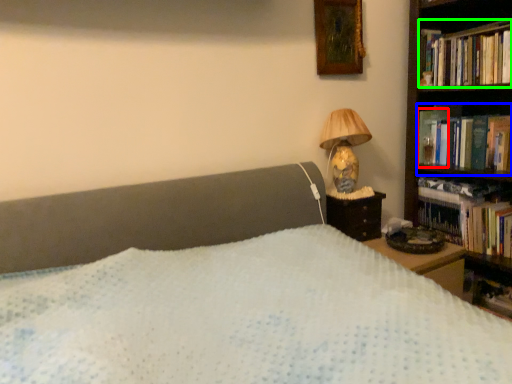
Question: Which object is the farthest from paperback book (highlighted by a red box)? Choose among these: book (highlighted by a blue box) or book (highlighted by a green box).

Choices:
 (A) book
 (B) book

Answer: (B)